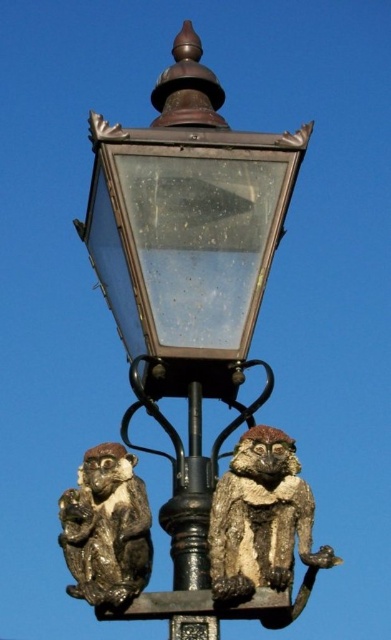
Question: Which of the following is the closest to the observer?

Choices:
 (A) bronze glass street light at center
 (B) black metal pole at center
 (C) bronze textured monkey at lower left
 (D) rusty metal monkey at lower right

Answer: (D)

Question: Which is farther from the bronze glass street light at center?

Choices:
 (A) black metal pole at center
 (B) bronze textured monkey at lower left

Answer: (B)

Question: Does bronze glass street light at center have a larger size compared to black metal pole at center?

Choices:
 (A) no
 (B) yes

Answer: (B)

Question: Considering the relative positions of bronze glass street light at center and rusty metal monkey at lower right in the image provided, where is bronze glass street light at center located with respect to rusty metal monkey at lower right?

Choices:
 (A) below
 (B) above

Answer: (B)

Question: Which object appears farthest from the camera in this image?

Choices:
 (A) bronze textured monkey at lower left
 (B) rusty metal monkey at lower right

Answer: (A)

Question: Is the position of bronze glass street light at center less distant than that of black metal pole at center?

Choices:
 (A) no
 (B) yes

Answer: (B)